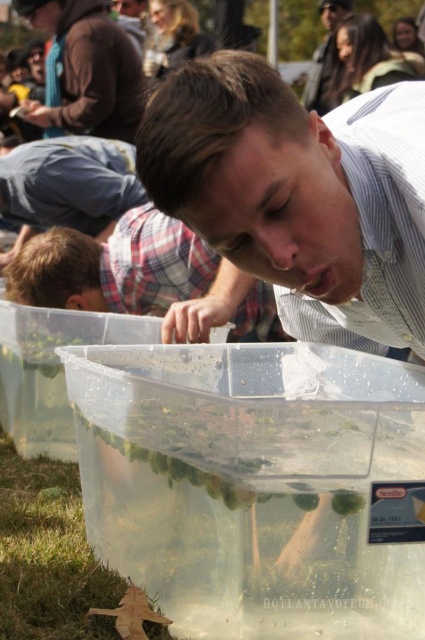
Question: Which of the following is the farthest from the observer?

Choices:
 (A) green leafy vegetable at lower center
 (B) matte white shirt at center
 (C) matte black shirt at upper center
 (D) plaid fabric shirt at center

Answer: (C)

Question: Is matte white shirt at center thinner than matte black shirt at upper center?

Choices:
 (A) no
 (B) yes

Answer: (A)

Question: Is matte brown shirt at upper center above green leafy vegetable at lower center?

Choices:
 (A) yes
 (B) no

Answer: (A)

Question: Which of these objects is positioned farthest from the matte blue shirt at center?

Choices:
 (A) matte black shirt at upper center
 (B) matte brown shirt at upper center
 (C) plaid fabric shirt at center
 (D) green leafy vegetable at lower center

Answer: (A)

Question: Among these objects, which one is nearest to the camera?

Choices:
 (A) matte blue shirt at center
 (B) green leafy vegetable at lower center
 (C) matte black shirt at upper center

Answer: (B)

Question: Can you confirm if matte brown shirt at upper center is smaller than matte black shirt at upper center?

Choices:
 (A) yes
 (B) no

Answer: (B)